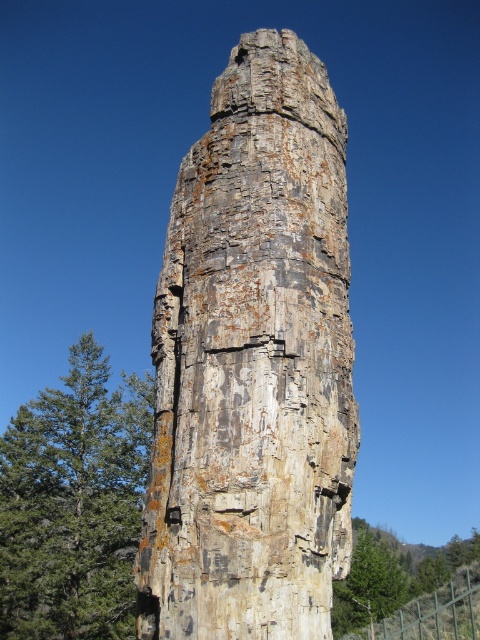
You are standing at the base of the tall rock formation and want to locate two specific points marked on a map. The first point is labeled as point [257,253], and the second is point [46,584]. According to the scene description, which point is closer to you when you are facing the rock formation?

Point [257,253] is in front of point [46,584], so it is closer to you when facing the rock formation.